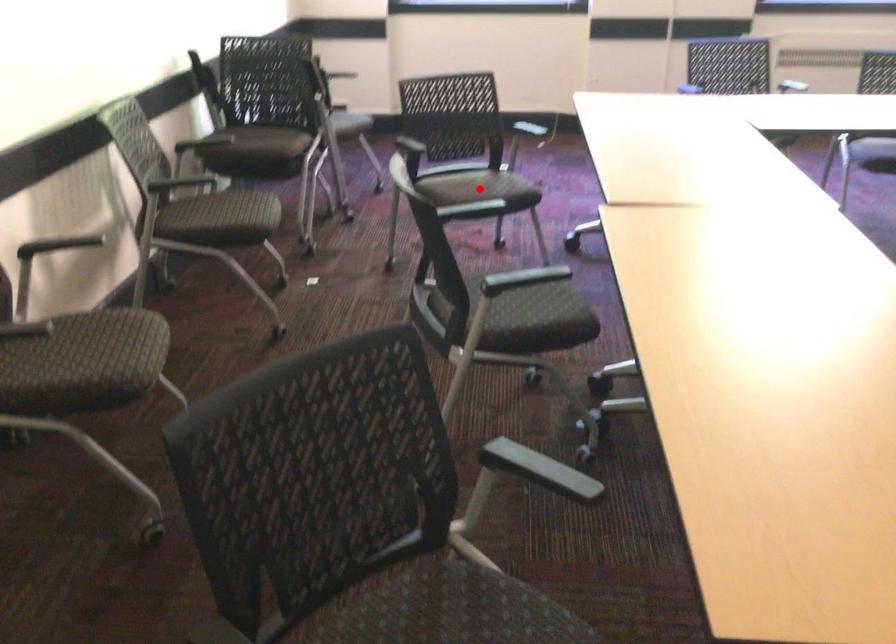
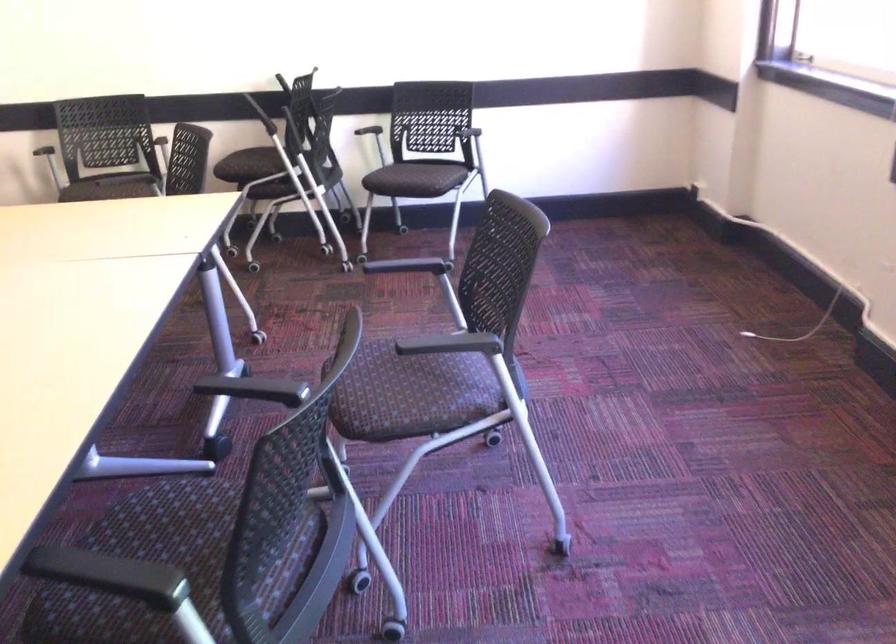
Question: I am providing you with two images of the same scene from different viewpoints. A red point is marked on the first image. At the location where the point appears in image 1, is it still visible in image 2?

Choices:
 (A) Yes
 (B) No

Answer: (B)